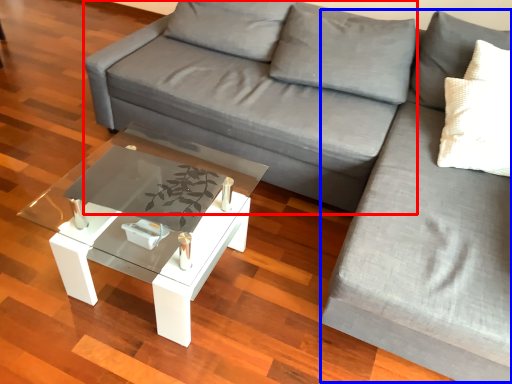
Question: Which of the following is the closest to the observer, couch (highlighted by a red box) or couch (highlighted by a blue box)?

Choices:
 (A) couch
 (B) couch

Answer: (B)